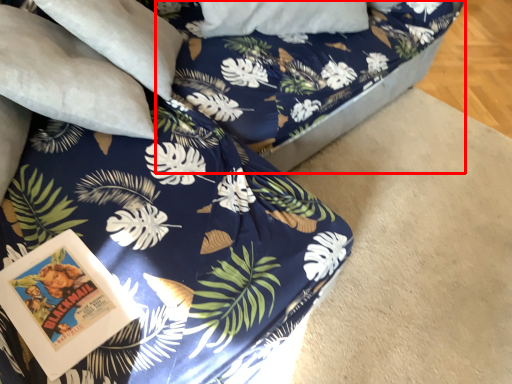
Question: Considering the relative positions of bed frame (annotated by the red box) and pillow in the image provided, where is bed frame (annotated by the red box) located with respect to the staircase?

Choices:
 (A) right
 (B) left

Answer: (A)